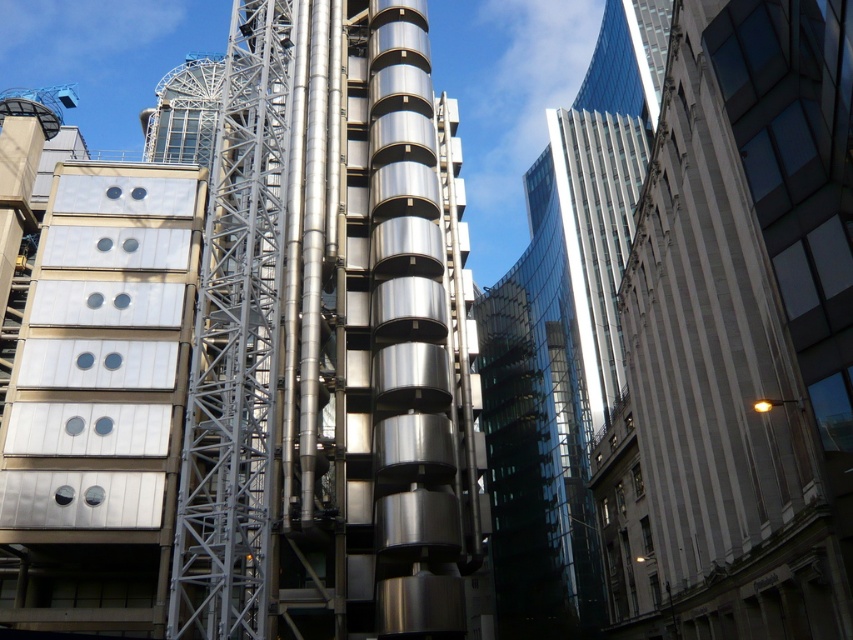
Is white glossy building at right thinner than glassy reflective skyscraper at upper right?

Yes.

Is point (833, 452) positioned behind point (482, 314)?

No.

Find the location of a particular element. This screenshot has width=853, height=640. white glossy building at right is located at coordinates (747, 321).

Can you confirm if metallic silver tower at center is bigger than white glossy building at right?

Correct, metallic silver tower at center is larger in size than white glossy building at right.

Which is below, metallic silver tower at center or white glossy building at right?

white glossy building at right

Find the location of a particular element. Image resolution: width=853 pixels, height=640 pixels. metallic silver tower at center is located at coordinates (329, 340).

Locate an element on the screen. metallic silver tower at center is located at coordinates (329, 340).

Based on the photo, does metallic silver tower at center have a lesser height compared to glassy reflective skyscraper at upper right?

Correct, metallic silver tower at center is not as tall as glassy reflective skyscraper at upper right.

You are a GUI agent. You are given a task and a screenshot of the screen. Output one action in this format:
    pyautogui.click(x=<x>, y=<y>)
    Task: Click on the metallic silver tower at center
    This screenshot has width=853, height=640.
    Given the screenshot: What is the action you would take?
    pyautogui.click(x=329, y=340)